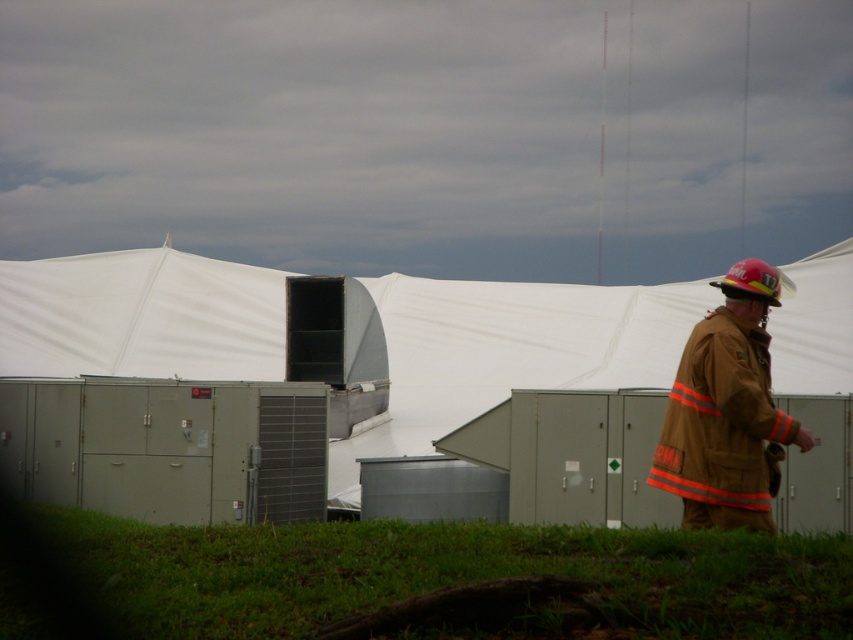
Question: Which of the following is the closest to the observer?

Choices:
 (A) (218, 637)
 (B) (158, 358)
 (C) (683, 452)

Answer: (A)

Question: Which point is farther to the camera?

Choices:
 (A) white fabric tent at center
 (B) brown fireman uniform at right

Answer: (A)

Question: Which is nearer to the green grass at lower center?

Choices:
 (A) brown fireman uniform at right
 (B) white fabric tent at center

Answer: (A)

Question: Can you confirm if green grass at lower center is positioned to the left of brown fireman uniform at right?

Choices:
 (A) yes
 (B) no

Answer: (A)

Question: Is the position of white fabric tent at center more distant than that of brown fireman uniform at right?

Choices:
 (A) yes
 (B) no

Answer: (A)

Question: Does green grass at lower center appear on the right side of brown fireman uniform at right?

Choices:
 (A) yes
 (B) no

Answer: (B)